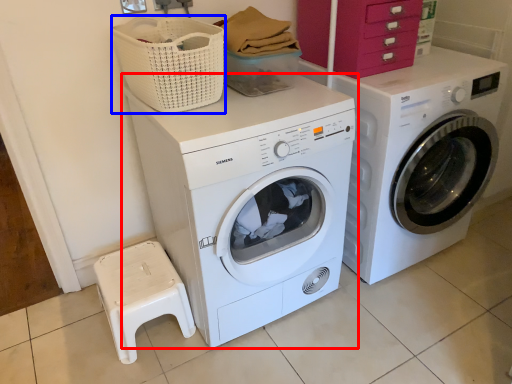
Question: Which object appears closest to the camera in this image, washing machine (highlighted by a red box) or basket (highlighted by a blue box)?

Choices:
 (A) washing machine
 (B) basket

Answer: (A)